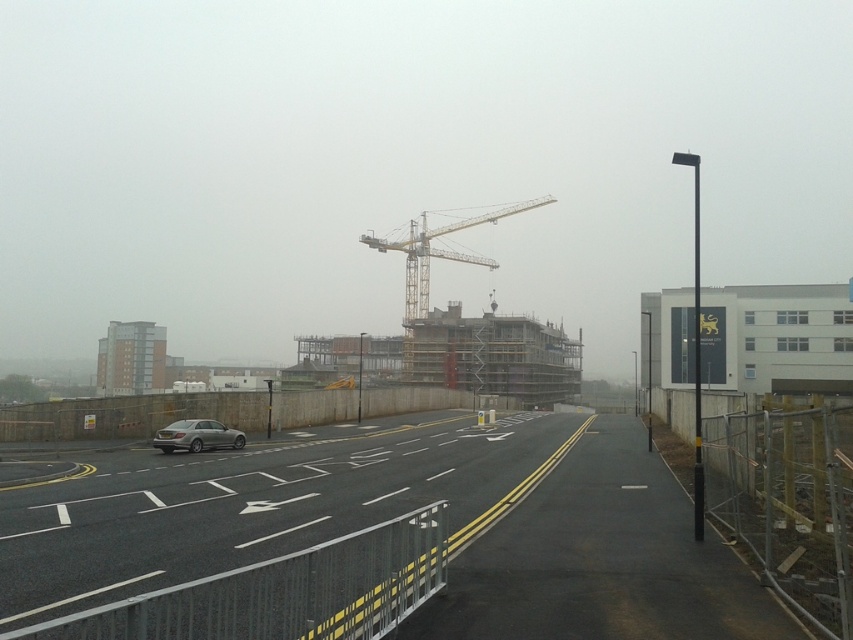
You are driving a satin silver sedan at center on a dark asphalt highway at center. Can you safely change lanes to the right without crossing the yellow dividing line?

The dark asphalt highway at center is wider than the satin silver sedan at center. Since the highway is wider, there is enough space to safely change lanes to the right without crossing the yellow dividing line.